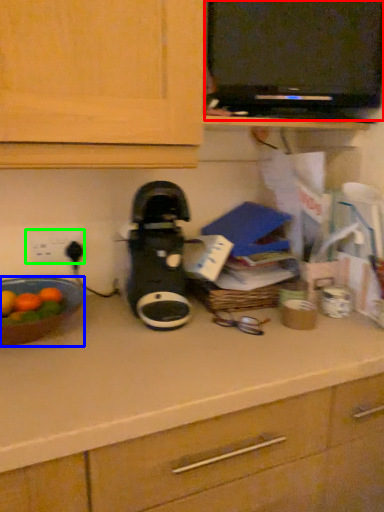
Question: Which object is the farthest from appliance (highlighted by a red box)? Choose among these: kitchen appliance (highlighted by a blue box) or electric outlet (highlighted by a green box).

Choices:
 (A) kitchen appliance
 (B) electric outlet

Answer: (A)